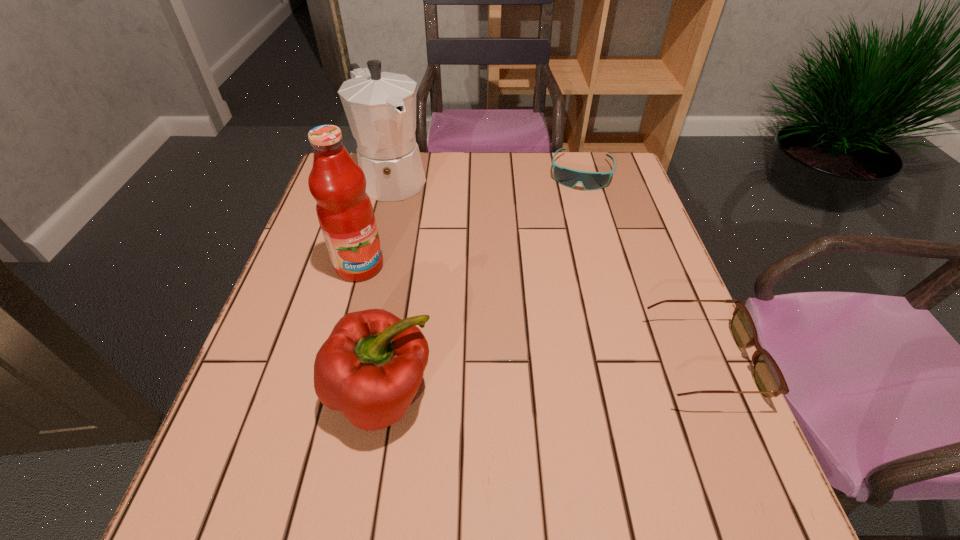
Find the location of a particular element. vacant space located on the front-facing side of the sunglasses is located at coordinates (574, 212).

Find the location of a particular element. vacant space located on the front-facing side of the sunglasses is located at coordinates (568, 240).

Where is `free space located 0.150m at the spout of the coffeepot`? The image size is (960, 540). free space located 0.150m at the spout of the coffeepot is located at coordinates (433, 230).

In order to click on vacant space located 0.380m at the spout of the coffeepot in this screenshot , I will do `click(483, 284)`.

At what (x,y) coordinates should I click in order to perform the action: click on free region located 0.360m at the spout of the coffeepot. Please return your answer as a coordinate pair (x, y). The image size is (960, 540). Looking at the image, I should click on (478, 279).

Identify the location of sunglasses situated at the far edge. The height and width of the screenshot is (540, 960). (568, 177).

This screenshot has width=960, height=540. I want to click on coffeepot that is at the far edge, so click(x=380, y=107).

At what (x,y) coordinates should I click in order to perform the action: click on bell pepper present at the near edge. Please return your answer as a coordinate pair (x, y). Image resolution: width=960 pixels, height=540 pixels. Looking at the image, I should click on (370, 368).

In order to click on spectacles present at the near edge in this screenshot , I will do `click(767, 375)`.

The height and width of the screenshot is (540, 960). I want to click on fruit juice located in the left edge section of the desktop, so click(345, 213).